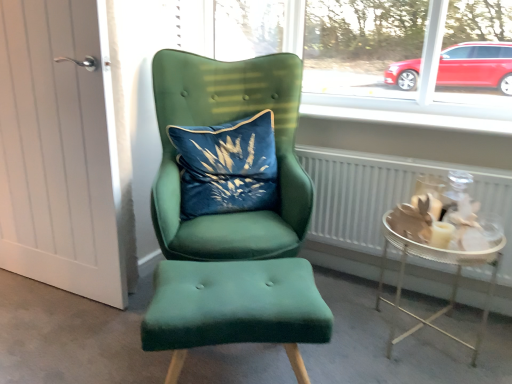
Question: Considering the positions of point (246, 173) and point (74, 4), is point (246, 173) closer or farther from the camera than point (74, 4)?

Choices:
 (A) farther
 (B) closer

Answer: (A)

Question: Is velvet blue pillow at center taller or shorter than white wood door at left?

Choices:
 (A) short
 (B) tall

Answer: (A)

Question: Which is nearer to the velvet blue pillow at center?

Choices:
 (A) velvet green stool at center
 (B) white textured radiator at lower right
 (C) white wood door at left
 (D) velvet green armchair at center
 (E) metallic silver tray at lower right

Answer: (D)

Question: Considering the real-world distances, which object is closest to the white textured radiator at lower right?

Choices:
 (A) velvet green armchair at center
 (B) metallic silver tray at lower right
 (C) white smooth window sill at upper center
 (D) velvet blue pillow at center
 (E) velvet green stool at center

Answer: (B)